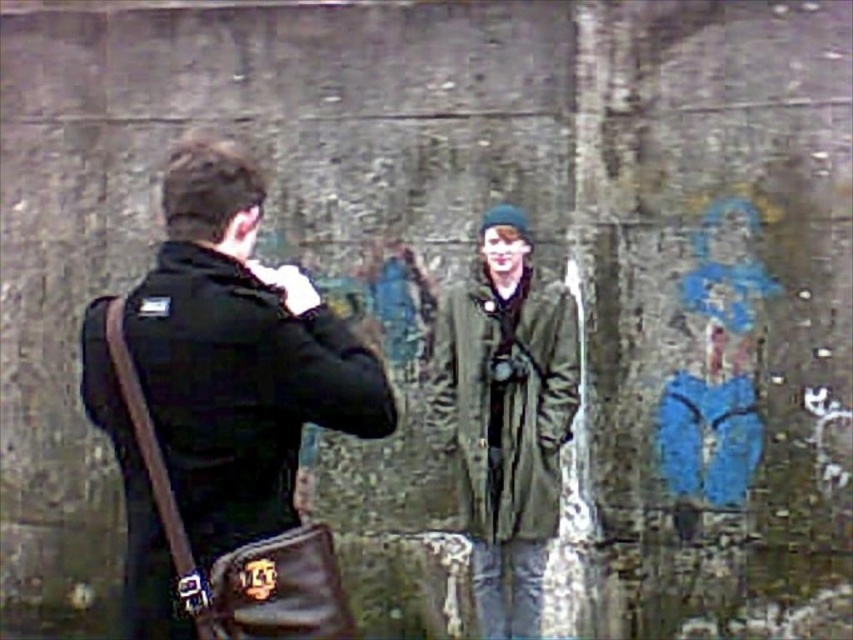
Question: Can you confirm if black leather bag at left is positioned to the left of olive green textured jacket at center?

Choices:
 (A) no
 (B) yes

Answer: (B)

Question: Which of the following is the farthest from the observer?

Choices:
 (A) (498, 394)
 (B) (167, 548)

Answer: (A)

Question: Does black leather bag at left appear on the left side of olive green textured jacket at center?

Choices:
 (A) no
 (B) yes

Answer: (B)

Question: Which point is farther from the camera taking this photo?

Choices:
 (A) pos(479,380)
 (B) pos(142,557)

Answer: (A)

Question: Is black leather bag at left further to the viewer compared to olive green textured jacket at center?

Choices:
 (A) no
 (B) yes

Answer: (A)